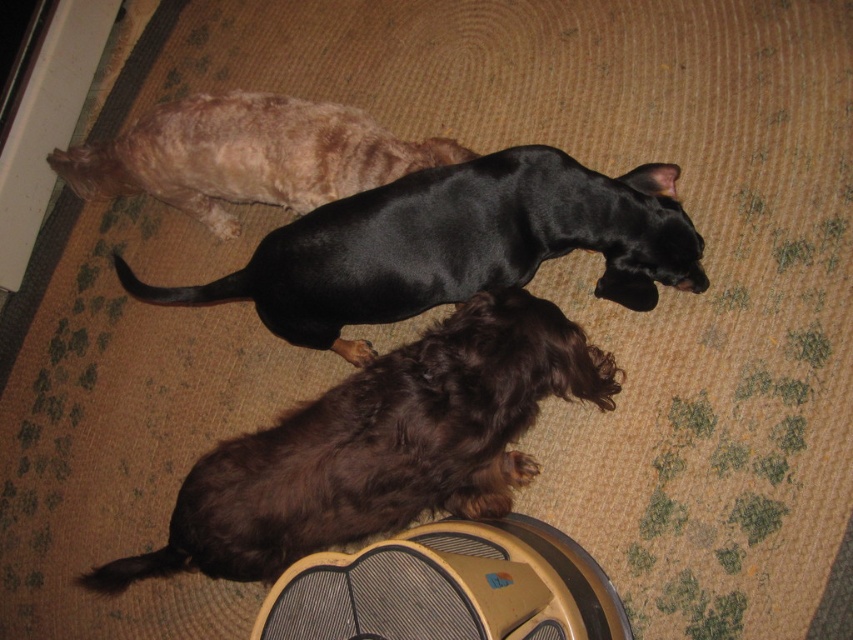
Question: Which point appears farthest from the camera in this image?

Choices:
 (A) (351, 173)
 (B) (250, 636)
 (C) (508, 260)
 (D) (277, 538)

Answer: (A)

Question: Which object is the closest to the gray fabric fan at lower center?

Choices:
 (A) black glossy dog at center
 (B) brown fuzzy dog at lower center
 (C) black shiny dog at upper center

Answer: (B)

Question: Is brown fuzzy dog at lower center to the left of gray fabric fan at lower center from the viewer's perspective?

Choices:
 (A) no
 (B) yes

Answer: (B)

Question: From the image, what is the correct spatial relationship of brown fuzzy dog at lower center in relation to black shiny dog at upper center?

Choices:
 (A) right
 (B) left

Answer: (A)

Question: Which point appears closest to the camera in this image?

Choices:
 (A) (486, 577)
 (B) (590, 353)
 (C) (234, 160)

Answer: (A)

Question: Does black glossy dog at center have a smaller size compared to gray fabric fan at lower center?

Choices:
 (A) yes
 (B) no

Answer: (B)